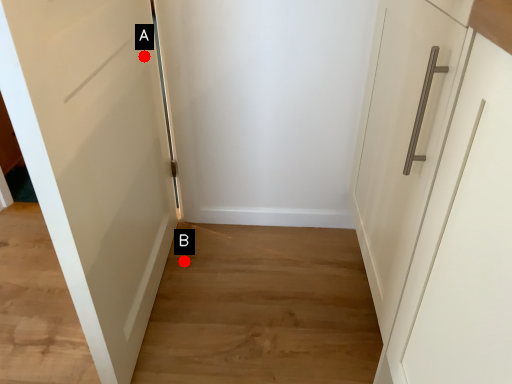
Question: Two points are circled on the image, labeled by A and B beside each circle. Which point is farther to the camera?

Choices:
 (A) A is further
 (B) B is further

Answer: (B)